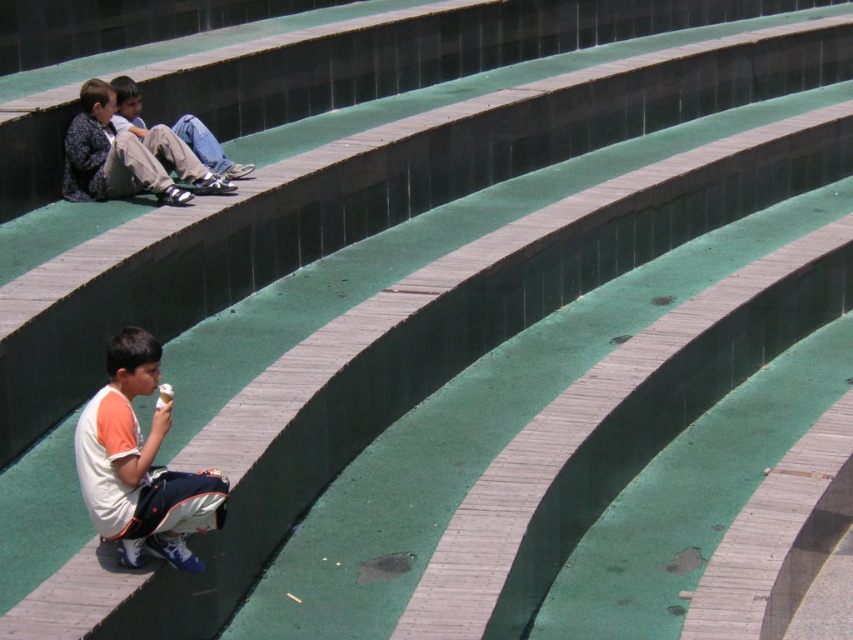
You are a photographer trying to capture a shot of the jeans at upper left and the white paper ice cream cone at lower left. Which object should you focus on first if you want to ensure both are in focus without adjusting your camera settings?

The jeans at upper left is much taller than the white paper ice cream cone at lower left, so focusing on the jeans at upper left first will help ensure both are in focus as they are at different distances from the camera.

You are a photographer positioned at the center of the amphitheater. You need to capture a photo that includes both the matte black jacket at upper left and the white paper ice cream cone at lower left. Which object should you adjust your camera angle to focus on first to ensure both are in frame?

You should focus on the matte black jacket at upper left first because it is closer to the viewer than the white paper ice cream cone at lower left, so adjusting the angle to include it will also likely include the ice cream cone in the background.